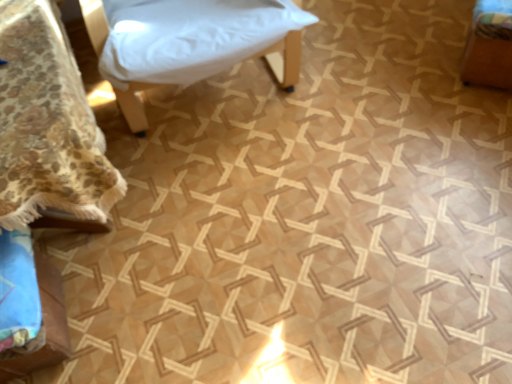
Locate an element on the screen. The image size is (512, 384). vacant space behind blue fabric cushion at lower left, the 3th furniture from the right is located at coordinates (94, 249).